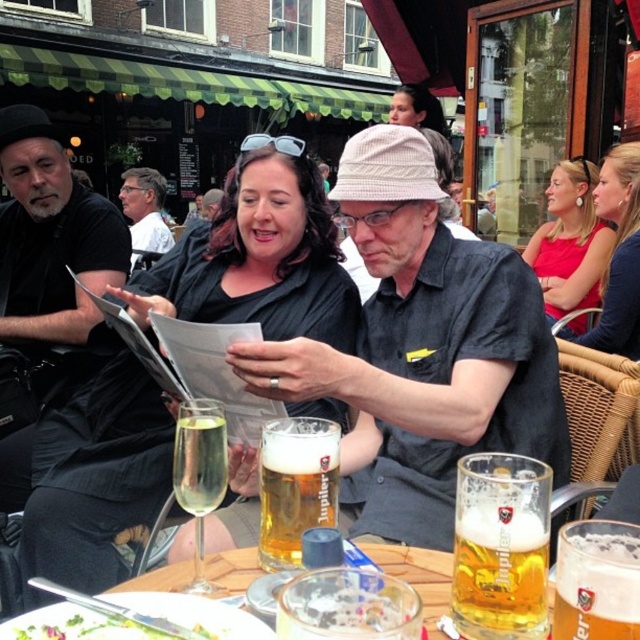
Question: Can you confirm if translucent glass mug at center is bigger than matte red dress at upper right?

Choices:
 (A) no
 (B) yes

Answer: (A)

Question: Estimate the real-world distances between objects in this image. Which object is closer to the matte black shirt at center?

Choices:
 (A) translucent glass mug at center
 (B) black matte shirt at left

Answer: (B)

Question: Which point appears closest to the camera in this image?

Choices:
 (A) tap(196, 445)
 (B) tap(422, 552)
 (C) tap(19, 628)
 (D) tap(563, 291)

Answer: (C)

Question: Which of the following is the farthest from the observer?

Choices:
 (A) (536, 241)
 (B) (410, 99)

Answer: (B)

Question: Observing the image, what is the correct spatial positioning of golden glass beer at center in reference to matte black shirt at center?

Choices:
 (A) above
 (B) below

Answer: (B)

Question: Is matte red dress at upper right further to the viewer compared to clear glass wine glass at center?

Choices:
 (A) no
 (B) yes

Answer: (B)